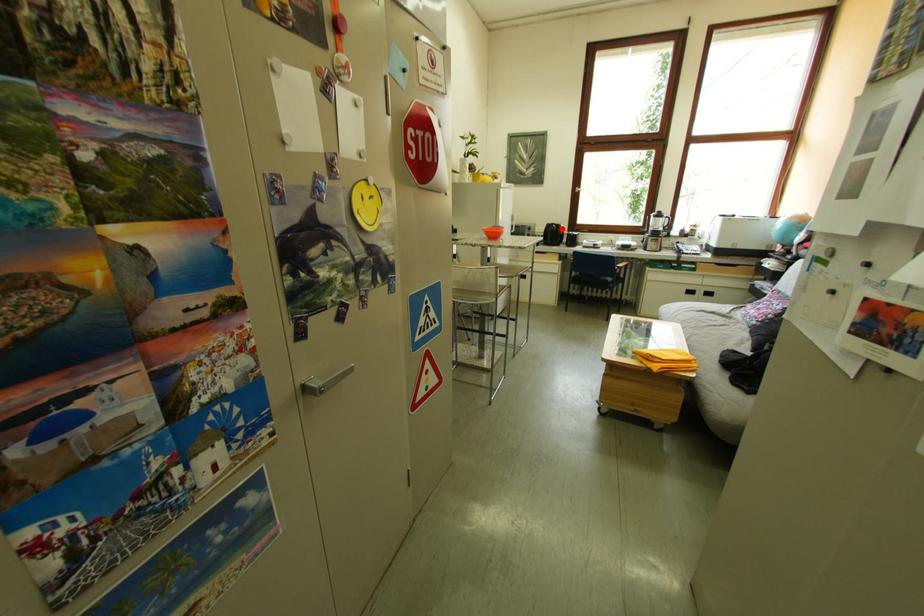
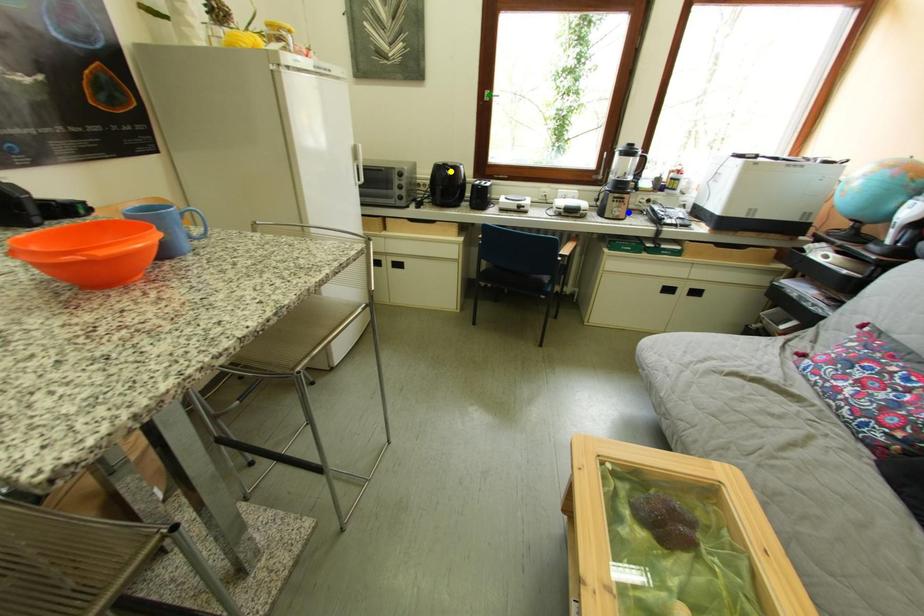
Question: I am providing you with two images of the same scene from different viewpoints. A red point is marked on the first image. You are given multiple points on the second image. Which point in image 2 is actually the same real-world point as the red point in image 1?

Choices:
 (A) blue point
 (B) green point
 (C) yellow point

Answer: (C)